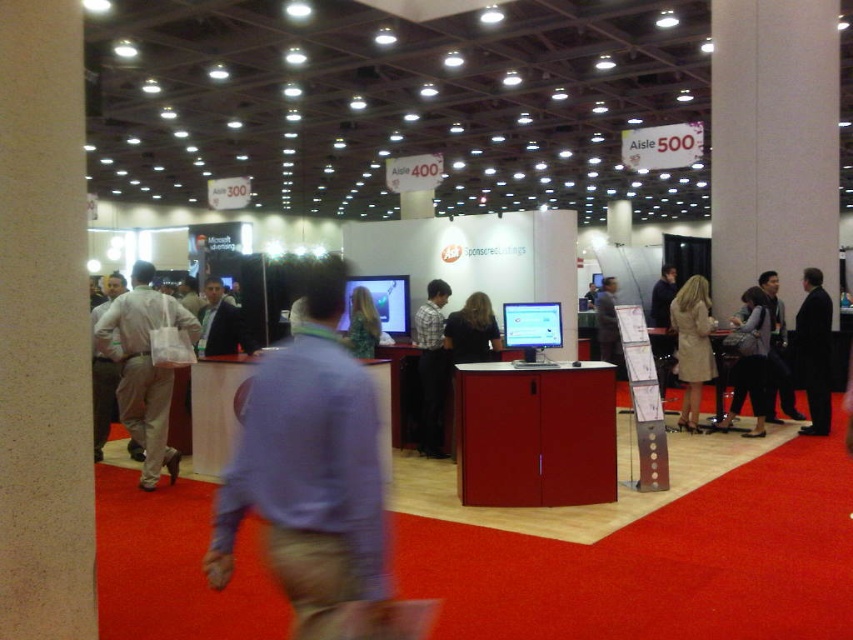
Question: Does white fabric bag at left have a lesser width compared to floral dress at center?

Choices:
 (A) yes
 (B) no

Answer: (B)

Question: Can you confirm if matte gray coat at center is thinner than floral dress at center?

Choices:
 (A) no
 (B) yes

Answer: (A)

Question: Is plaid shirt at center above light beige fabric bag at left?

Choices:
 (A) yes
 (B) no

Answer: (B)

Question: Which point appears closest to the camera in this image?

Choices:
 (A) (604, 312)
 (B) (241, 333)
 (C) (822, 352)
 (D) (131, 445)

Answer: (D)

Question: Among these objects, which one is nearest to the camera?

Choices:
 (A) white fabric bag at left
 (B) light beige coat at right

Answer: (A)

Question: Which of the following is the closest to the observer?

Choices:
 (A) plaid shirt at center
 (B) light beige fabric bag at left
 (C) white fabric bag at left

Answer: (B)